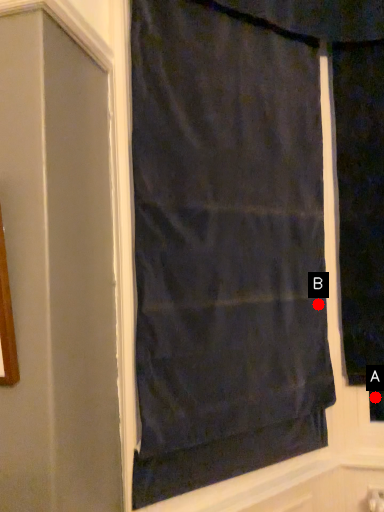
Question: Two points are circled on the image, labeled by A and B beside each circle. Among these points, which one is nearest to the camera?

Choices:
 (A) A is closer
 (B) B is closer

Answer: (B)